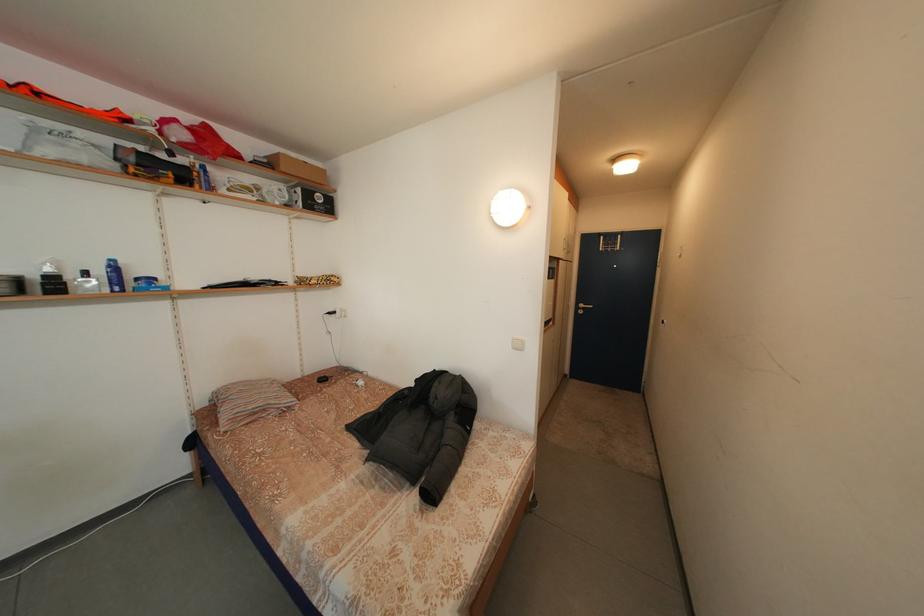
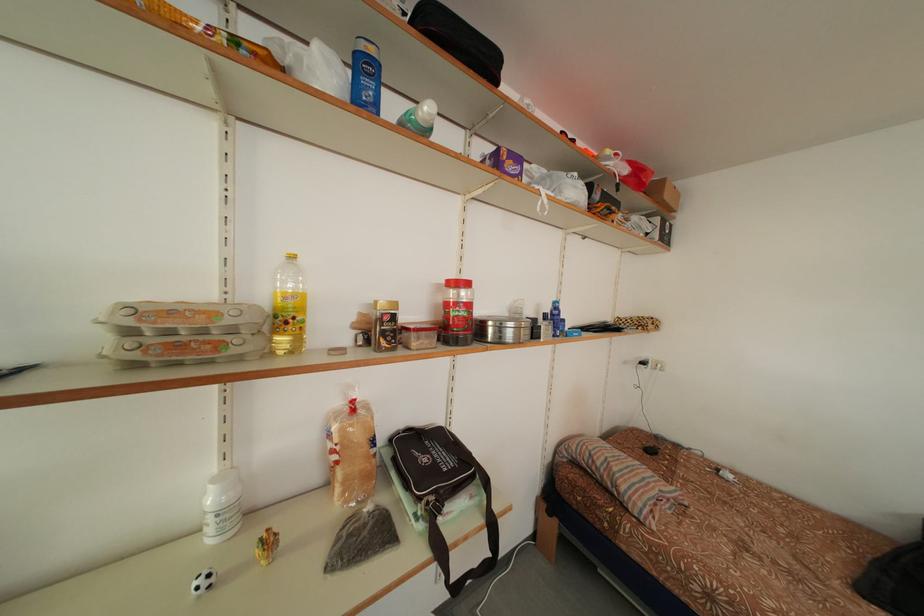
Question: In a continuous first-person perspective shot, in which direction is the camera moving?

Choices:
 (A) Left
 (B) Right
 (C) Forward
 (D) Backward

Answer: (A)